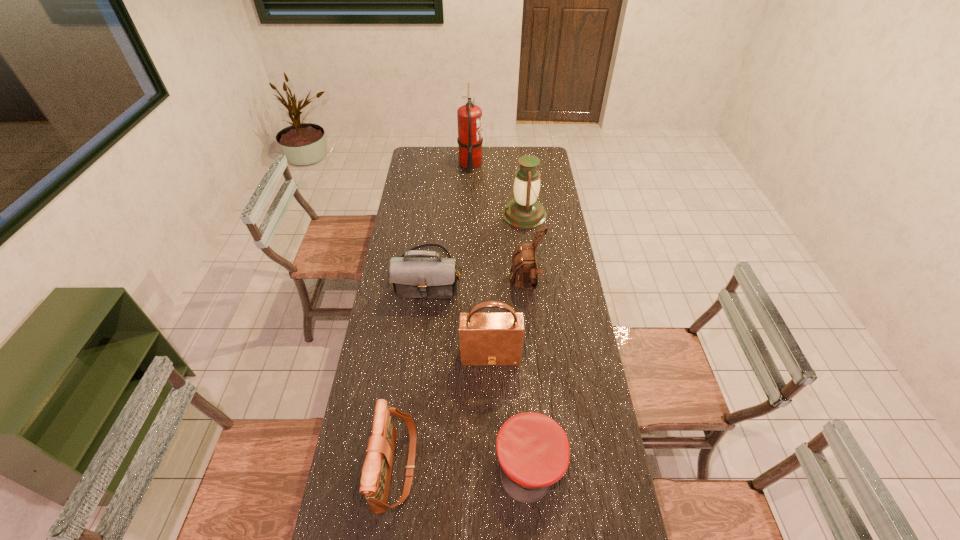
Where is `free space located on the front flap of the second nearest shoulder bag`? free space located on the front flap of the second nearest shoulder bag is located at coordinates (492, 468).

Where is `vacant area located on the front-facing side of the nearest shoulder bag`? vacant area located on the front-facing side of the nearest shoulder bag is located at coordinates (473, 467).

Image resolution: width=960 pixels, height=540 pixels. In order to click on blank area located on the front of the shortest object with an emblem in this screenshot , I will do `click(536, 528)`.

This screenshot has height=540, width=960. Find the location of `object located at the far edge`. object located at the far edge is located at coordinates (469, 117).

Where is `lantern that is positioned at the right edge`? lantern that is positioned at the right edge is located at coordinates (525, 212).

This screenshot has width=960, height=540. Find the location of `shoulder bag that is at the right edge`. shoulder bag that is at the right edge is located at coordinates (524, 270).

This screenshot has width=960, height=540. Find the location of `cap located in the right edge section of the desktop`. cap located in the right edge section of the desktop is located at coordinates [x=533, y=451].

In order to click on vacant point at the far edge in this screenshot , I will do `click(442, 166)`.

Locate an element on the screen. The width and height of the screenshot is (960, 540). free region at the left edge is located at coordinates (413, 319).

You are a GUI agent. You are given a task and a screenshot of the screen. Output one action in this format:
    pyautogui.click(x=<x>, y=<y>)
    Task: Click on the free space at the right edge
    
    Given the screenshot: What is the action you would take?
    pyautogui.click(x=587, y=504)